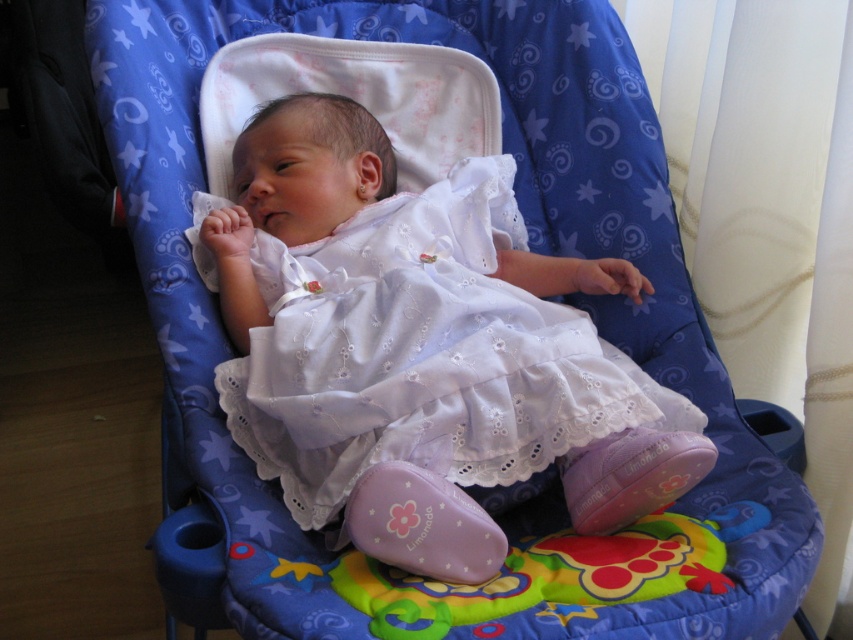
You are a photographer taking a closeup shot of the baby. You need to focus on the white lace dress at center and the silver metallic teething ring at ear. Which object should you adjust your camera focus to first if the teething ring is closer to the camera than the dress?

The silver metallic teething ring at ear is closer to the camera than the white lace dress at center, so you should focus on the silver metallic teething ring at ear first.

You are a photographer taking a closeup shot of the baby in the bouncer. You have two points marked in the image for focus adjustment. The first point is at point (285, 134) and the second is at point (357, 188). Which point should you focus on to ensure the baby is in sharp focus?

You should focus on point (285, 134) because it is closer to the viewer than point (357, 188), ensuring the baby is in sharp focus.

You are a photographer setting up a shoot in the room. You need to position a spotlight so that it illuminates the white lace dress at center without affecting the background. Based on the dress location, where should you aim the spotlight?

The white lace dress at center is located at point (422,349), so aim the spotlight at those coordinates to focus on the dress while minimizing background illumination.